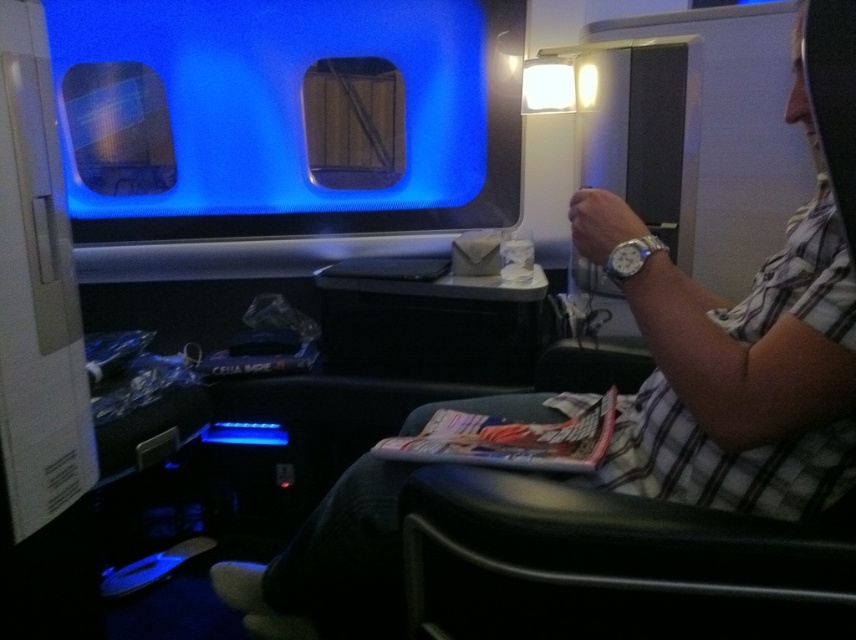
You are a passenger in the train compartment and want to know which of the two points, point (191, 29) or point (390, 452), is closer to you. Can you determine this based on their positions?

Point (191, 29) is closer to you than point (390, 452) because it is further to the viewer.

You are a passenger sitting in the train compartment. You want to read the printed paper magazine at center without moving your head. Can you see the transparent plastic airplane window at upper center blocking your view of the magazine?

The transparent plastic airplane window at upper center is positioned over the printed paper magazine at center, so it would block your view of the magazine unless you move your head or adjust your position.

You are a passenger seated in the train compartment. You want to read the printed paper magazine at center while looking out the transparent plastic airplane window at upper center. Is the magazine blocking your view of the window?

The transparent plastic airplane window at upper center is further to the viewer than the printed paper magazine at center, so the magazine is closer to you and would block your view of the window.